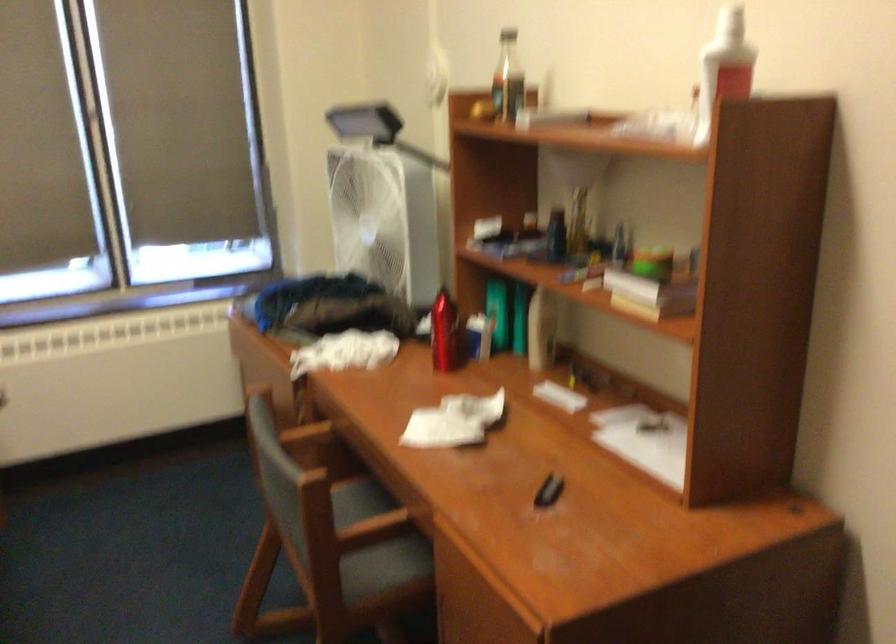
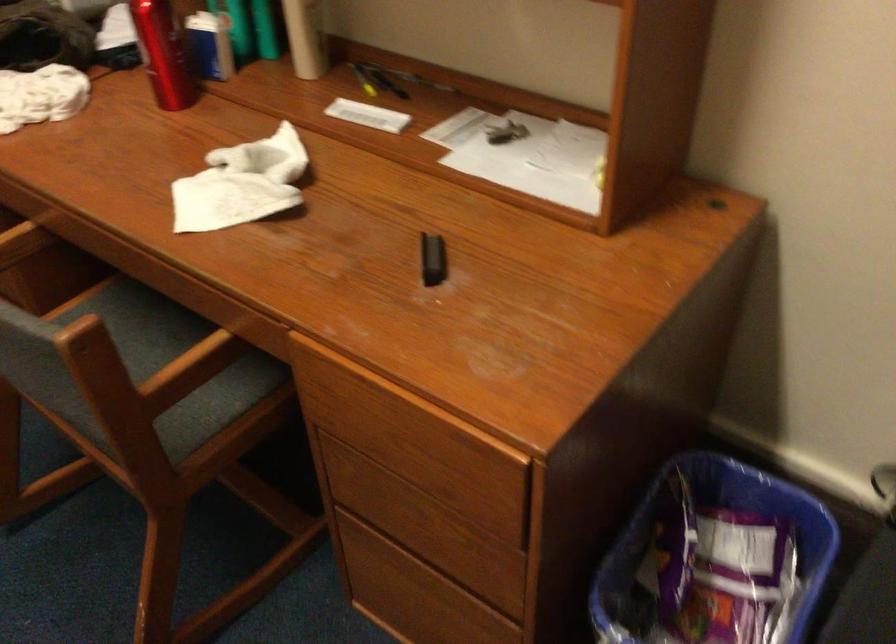
Find the pixel in the second image that matches (573,375) in the first image.

(363, 80)